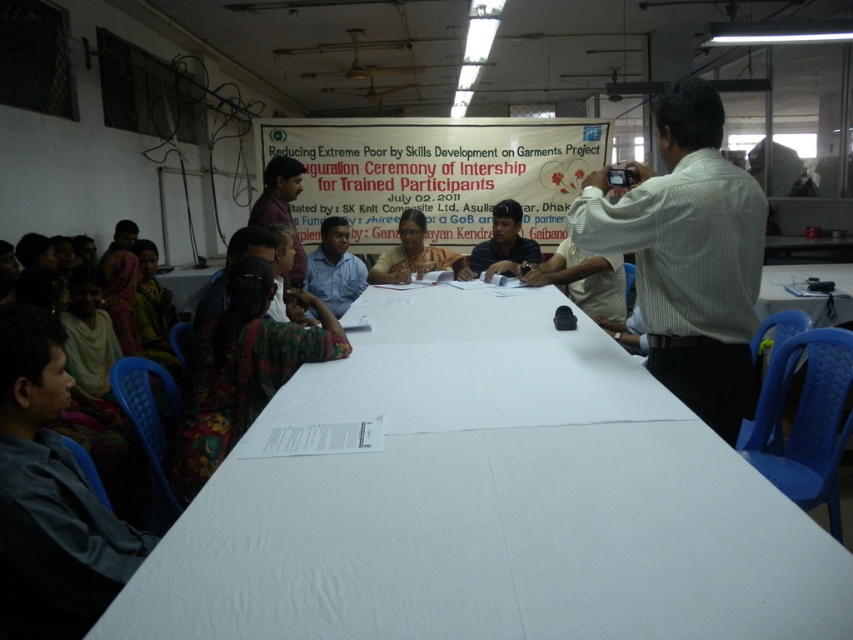
Which of these two, matte blue shirt at center or dark blue shirt at center, stands shorter?

Standing shorter between the two is dark blue shirt at center.

Does matte blue shirt at center have a lesser height compared to dark blue shirt at center?

In fact, matte blue shirt at center may be taller than dark blue shirt at center.

Image resolution: width=853 pixels, height=640 pixels. I want to click on matte blue shirt at center, so click(334, 268).

Is dark blue shirt at lower left further to the viewer compared to matte blue shirt at center?

No, it is not.

Who is shorter, dark blue shirt at lower left or matte blue shirt at center?

Result: Standing shorter between the two is matte blue shirt at center.

Is point (3, 387) positioned in front of point (328, 248)?

Yes, it is.

Where is `dark blue shirt at lower left`? dark blue shirt at lower left is located at coordinates (50, 497).

Between point (691, 104) and point (347, 256), which one is positioned behind?

Point (347, 256)

Does striped cotton shirt at upper right appear on the left side of matte blue shirt at center?

Incorrect, striped cotton shirt at upper right is not on the left side of matte blue shirt at center.

Is point (715, 262) more distant than point (328, 218)?

No, (715, 262) is closer to viewer.

Locate an element on the screen. The height and width of the screenshot is (640, 853). striped cotton shirt at upper right is located at coordinates (688, 253).